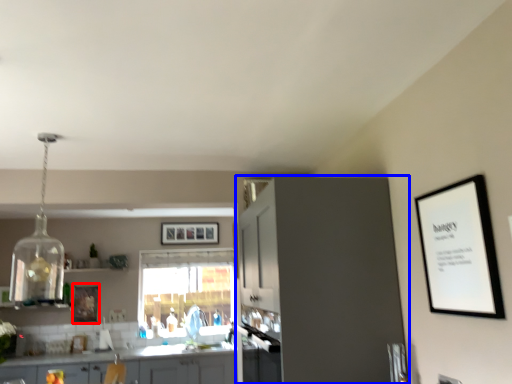
Question: Among these objects, which one is farthest to the camera, picture frame (highlighted by a red box) or cabinetry (highlighted by a blue box)?

Choices:
 (A) picture frame
 (B) cabinetry

Answer: (A)